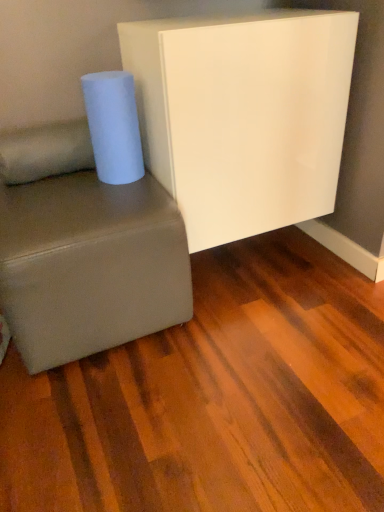
Locate an element on the screen. free space in front of suede-like gray studio couch at lower left is located at coordinates (122, 419).